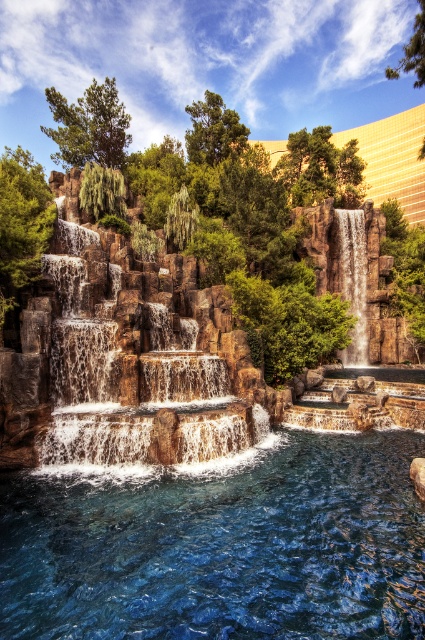
Between brown textured rock waterfall at center and smooth stone waterfall at center, which one is positioned lower?

brown textured rock waterfall at center

Is point (201, 355) closer to camera compared to point (362, 276)?

Yes, it is in front of point (362, 276).

You are a GUI agent. You are given a task and a screenshot of the screen. Output one action in this format:
    pyautogui.click(x=<x>, y=<y>)
    Task: Click on the brown textured rock waterfall at center
    
    Given the screenshot: What is the action you would take?
    pyautogui.click(x=136, y=362)

Locate an element on the screen. Image resolution: width=425 pixels, height=640 pixels. translucent blue water at center is located at coordinates (221, 547).

Who is more forward, (57, 552) or (116, 412)?

Point (57, 552) is in front.

Identify the location of translucent blue water at center. The width and height of the screenshot is (425, 640). (221, 547).

Is translucent blue water at center behind smooth stone waterfall at center?

No.

Is translucent blue water at center to the right of smooth stone waterfall at center from the viewer's perspective?

Incorrect, translucent blue water at center is not on the right side of smooth stone waterfall at center.

Identify the location of translucent blue water at center. (221, 547).

Find the location of a particular element. The height and width of the screenshot is (640, 425). translucent blue water at center is located at coordinates (221, 547).